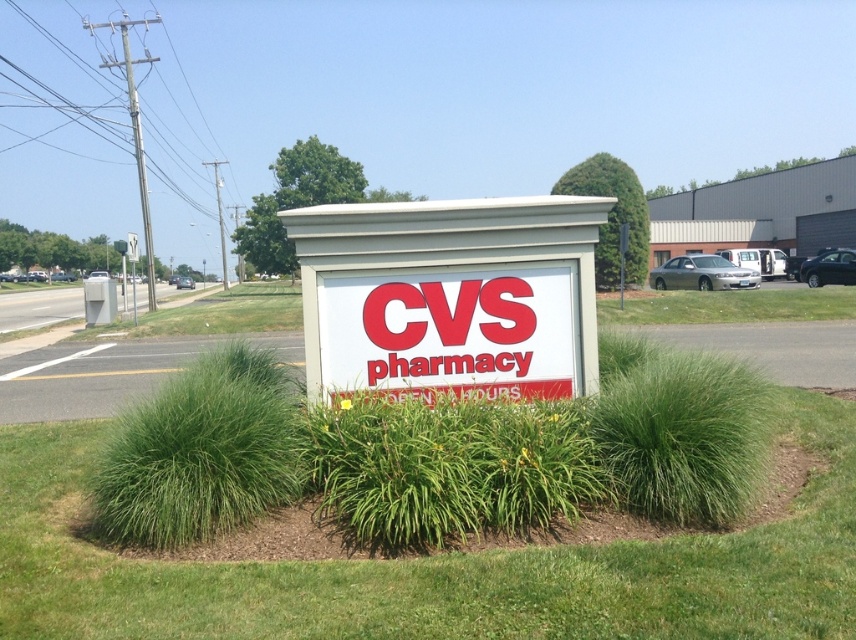
This screenshot has height=640, width=856. Find the location of `green leafy grass at center`. green leafy grass at center is located at coordinates (432, 566).

Is point (45, 586) positioned in front of point (486, 364)?

Yes, it is in front of point (486, 364).

Does point (497, 550) lie in front of point (480, 248)?

Yes.

I want to click on green leafy grass at center, so click(x=432, y=566).